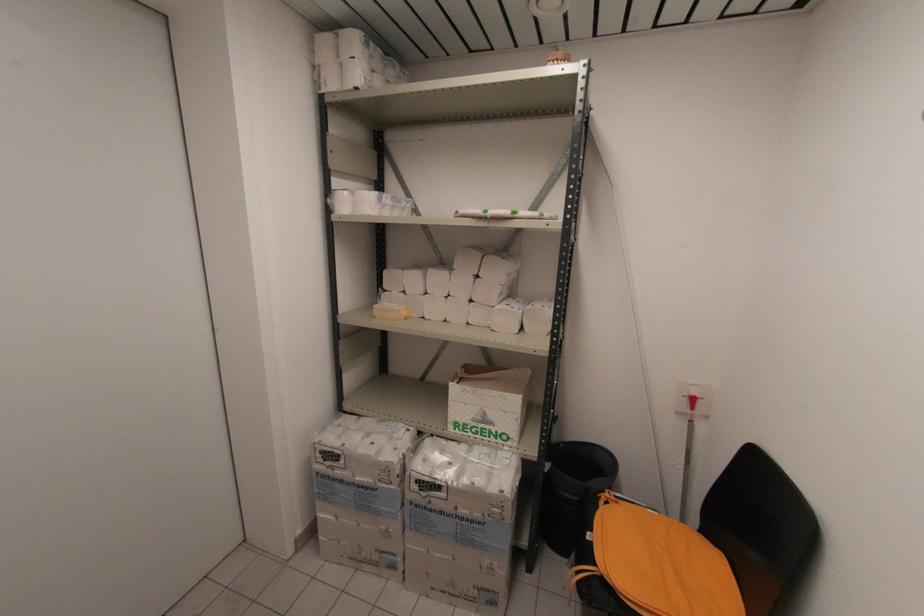
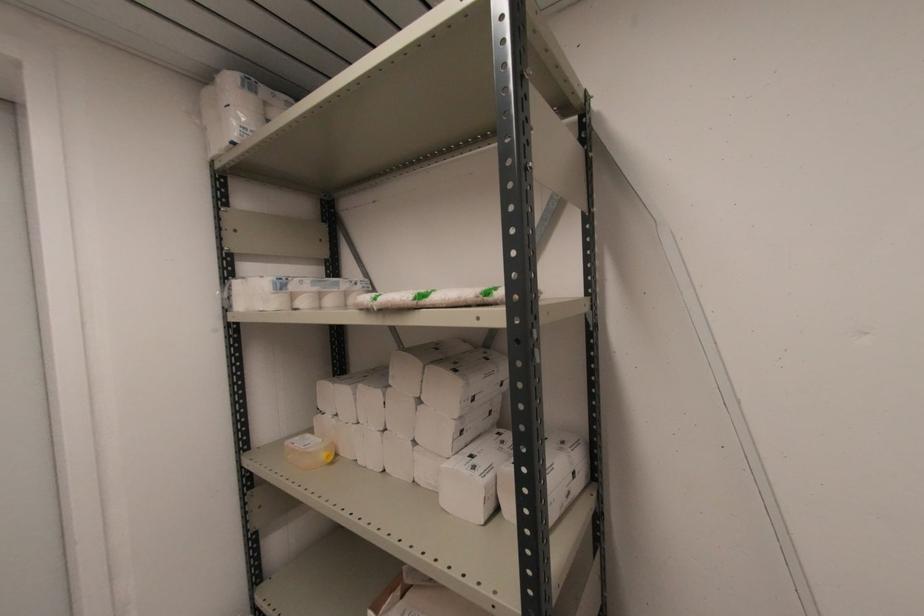
Where in the second image is the point corresponding to point 353,87 from the first image?

(227, 144)